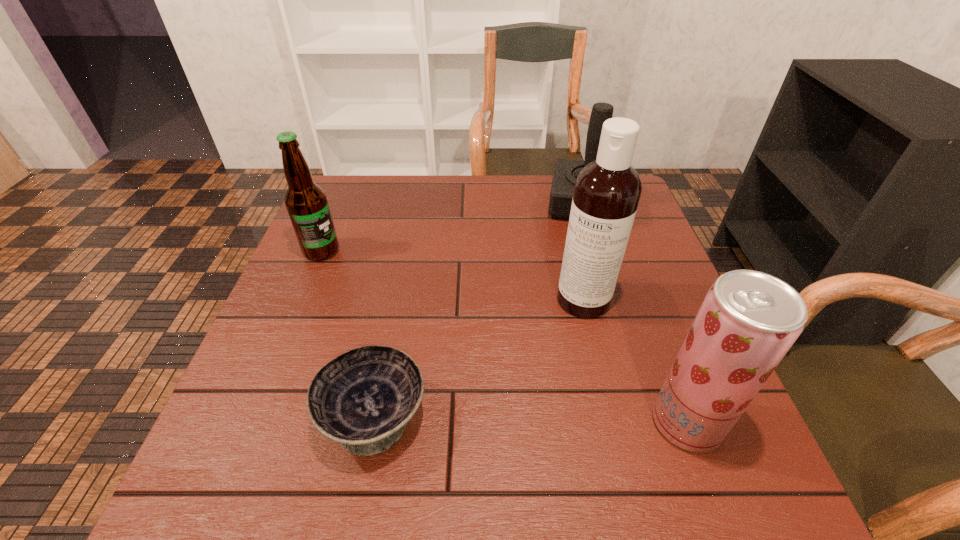
Identify the location of bowl present at the near edge. (363, 399).

Identify the location of fruit juice present at the near edge. This screenshot has width=960, height=540. (748, 321).

At what (x,y) coordinates should I click in order to perform the action: click on object situated at the left edge. Please return your answer as a coordinate pair (x, y). Looking at the image, I should click on (306, 202).

Where is `fruit juice present at the right edge`? Image resolution: width=960 pixels, height=540 pixels. fruit juice present at the right edge is located at coordinates (748, 321).

The width and height of the screenshot is (960, 540). In order to click on dishwasher detergent at the right edge in this screenshot , I will do `click(607, 191)`.

Where is `joystick that is positioned at the right edge`? This screenshot has height=540, width=960. joystick that is positioned at the right edge is located at coordinates (566, 171).

At what (x,y) coordinates should I click in order to perform the action: click on object that is positioned at the far right corner. Please return your answer as a coordinate pair (x, y). Image resolution: width=960 pixels, height=540 pixels. Looking at the image, I should click on (566, 171).

I want to click on object located at the near right corner, so click(x=748, y=321).

Locate an element on the screen. vacant area at the far edge of the desktop is located at coordinates (386, 191).

Identify the location of free location at the near edge. The width and height of the screenshot is (960, 540). (578, 411).